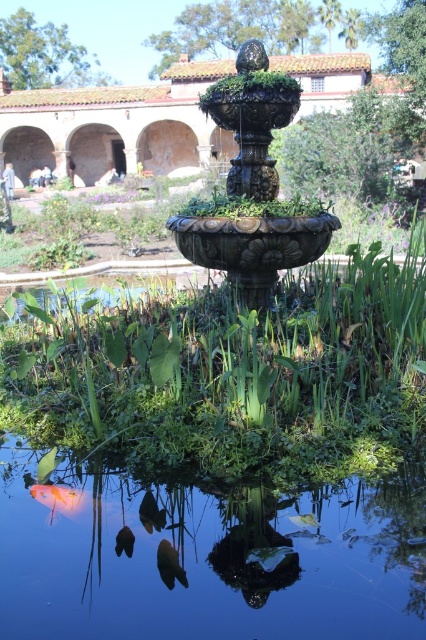
Does glossy blue water at center bottom have a lesser height compared to orange glossy fish at lower left?

In fact, glossy blue water at center bottom may be taller than orange glossy fish at lower left.

Find the location of a particular element. Image resolution: width=426 pixels, height=640 pixels. glossy blue water at center bottom is located at coordinates (206, 560).

Find the location of a particular element. glossy blue water at center bottom is located at coordinates (206, 560).

Is bronze textured fountain at center thinner than orange glossy fish at lower left?

In fact, bronze textured fountain at center might be wider than orange glossy fish at lower left.

Is bronze textured fountain at center to the left of orange glossy fish at lower left from the viewer's perspective?

In fact, bronze textured fountain at center is to the right of orange glossy fish at lower left.

Does point (224, 196) come in front of point (95, 499)?

No.

Where is `bronze textured fountain at center`? The height and width of the screenshot is (640, 426). bronze textured fountain at center is located at coordinates (252, 188).

Who is positioned more to the left, glossy blue water at center bottom or bronze textured fountain at center?

glossy blue water at center bottom

Find the location of a particular element. This screenshot has width=426, height=640. glossy blue water at center bottom is located at coordinates (206, 560).

Locate an element on the screen. The image size is (426, 640). glossy blue water at center bottom is located at coordinates (206, 560).